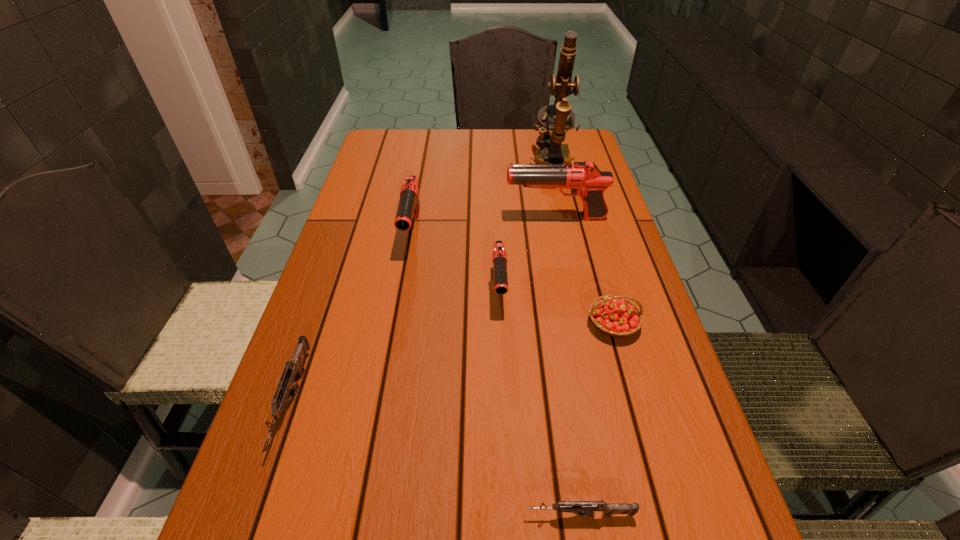
Identify the location of the fifth closest object to the nearest gun. (584, 178).

Identify which object is the third nearest to the nearest black gun. Please provide its 2D coordinates. Your answer should be formatted as a tuple, i.e. [(x, y)], where the tuple contains the x and y coordinates of a point satisfying the conditions above.

[(408, 208)]

Identify which gun is the third nearest to the third gun from left to right. Please provide its 2D coordinates. Your answer should be formatted as a tuple, i.e. [(x, y)], where the tuple contains the x and y coordinates of a point satisfying the conditions above.

[(295, 366)]

You are a GUI agent. You are given a task and a screenshot of the screen. Output one action in this format:
    pyautogui.click(x=<x>, y=<y>)
    Task: Click on the gun that is the third closest to the leftmost object
    
    Given the screenshot: What is the action you would take?
    pos(582,508)

Select which black gun appears as the third closest to the brown strawberry. Please provide its 2D coordinates. Your answer should be formatted as a tuple, i.e. [(x, y)], where the tuple contains the x and y coordinates of a point satisfying the conditions above.

[(408, 208)]

This screenshot has width=960, height=540. In order to click on the second closest black gun to the tallest gun in this screenshot , I will do `click(408, 208)`.

Where is `vacant space that satisfies the following two spatial constraints: 1. at the aiming end of the biggest black gun; 2. aimed along the barrel of the second shortest gun`? vacant space that satisfies the following two spatial constraints: 1. at the aiming end of the biggest black gun; 2. aimed along the barrel of the second shortest gun is located at coordinates (593, 400).

Locate an element on the screen. This screenshot has height=540, width=960. vacant space that satisfies the following two spatial constraints: 1. at the aiming end of the tallest gun; 2. on the right side of the strawberry is located at coordinates (578, 324).

Locate an element on the screen. The height and width of the screenshot is (540, 960). vacant space that satisfies the following two spatial constraints: 1. on the back side of the brown strawberry; 2. at the aiming end of the sixth shortest object is located at coordinates (583, 218).

Identify the location of vacant space that satisfies the following two spatial constraints: 1. at the aiming end of the brown strawberry; 2. on the left side of the rightmost black gun. (578, 324).